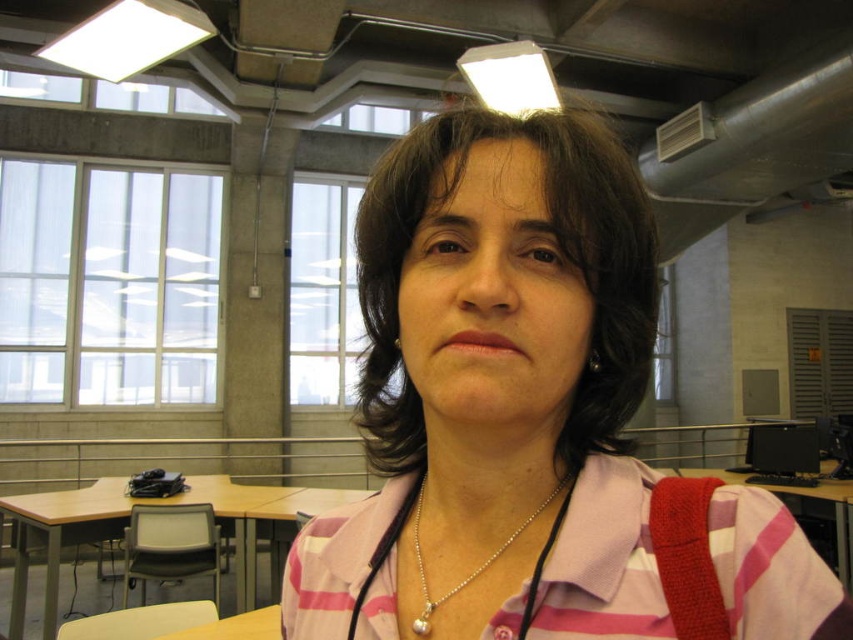
Question: Is pink striped shirt at center wider than brown wooden table at lower left?

Choices:
 (A) yes
 (B) no

Answer: (B)

Question: Among these objects, which one is farthest from the camera?

Choices:
 (A) wooden table at right
 (B) brown wooden table at lower left
 (C) silver metallic necklace at center

Answer: (A)

Question: In this image, where is pink striped shirt at center located relative to brown wooden table at lower left?

Choices:
 (A) below
 (B) above

Answer: (B)

Question: Does pink striped shirt at center have a larger size compared to silver metallic necklace at center?

Choices:
 (A) no
 (B) yes

Answer: (B)

Question: Which point appears closest to the camera in this image?

Choices:
 (A) (7, 504)
 (B) (558, 484)

Answer: (B)

Question: Among these points, which one is farthest from the camera?

Choices:
 (A) (714, 468)
 (B) (529, 604)

Answer: (A)